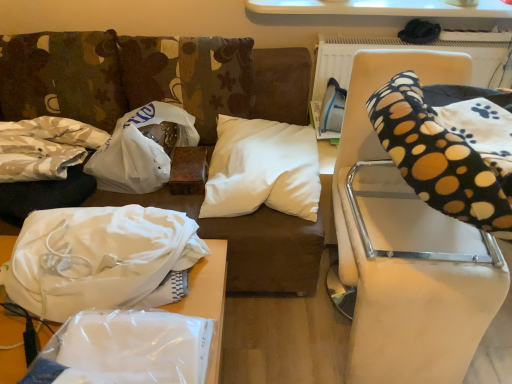
Question: Is white plastic bag at center, the 1th material viewed from the right, closer to camera compared to white fabric at left, the 1th material in the left-to-right sequence?

Choices:
 (A) yes
 (B) no

Answer: (B)

Question: From a real-world perspective, is white plastic bag at center, the 3th material from the left, located higher than white fabric at left, which ranks as the 3th material in right-to-left order?

Choices:
 (A) yes
 (B) no

Answer: (B)

Question: Is white plastic bag at center, the 3th material from the left, touching white fabric at left, the 1th material in the left-to-right sequence?

Choices:
 (A) yes
 (B) no

Answer: (B)

Question: Is white fabric at left, which ranks as the 3th material in right-to-left order, completely or partially inside white plastic bag at center, the 1th material viewed from the right?

Choices:
 (A) yes
 (B) no

Answer: (B)

Question: Does white plastic bag at center, the 1th material viewed from the right, have a smaller size compared to white fabric at left, the 1th material in the left-to-right sequence?

Choices:
 (A) no
 (B) yes

Answer: (B)

Question: From the image's perspective, does white plastic bag at center, the 3th material from the left, appear higher than white fabric at left, which ranks as the 3th material in right-to-left order?

Choices:
 (A) yes
 (B) no

Answer: (A)

Question: Is white fabric at lower left, arranged as the 2th material when viewed from the right, to the left of white fabric at left, which ranks as the 3th material in right-to-left order, from the viewer's perspective?

Choices:
 (A) yes
 (B) no

Answer: (B)

Question: Is white fabric at lower left, arranged as the 2th material when viewed from the right, wider than white fabric at left, the 1th material in the left-to-right sequence?

Choices:
 (A) yes
 (B) no

Answer: (A)

Question: Does white fabric at lower left, arranged as the 2th material when viewed from the right, have a greater height compared to white fabric at left, the 1th material in the left-to-right sequence?

Choices:
 (A) yes
 (B) no

Answer: (A)

Question: Does white fabric at lower left, arranged as the 2th material when viewed from the right, have a lesser height compared to white fabric at left, the 1th material in the left-to-right sequence?

Choices:
 (A) yes
 (B) no

Answer: (B)

Question: Does white fabric at lower left, which appears as the 2th material when viewed from the left, come behind white fabric at left, which ranks as the 3th material in right-to-left order?

Choices:
 (A) no
 (B) yes

Answer: (A)

Question: Could you tell me if white fabric at lower left, arranged as the 2th material when viewed from the right, is facing white fabric at left, the 1th material in the left-to-right sequence?

Choices:
 (A) yes
 (B) no

Answer: (B)

Question: Can you see transparent plastic bag at lower left, acting as the second furniture starting from the right, touching white fabric at left, the 1th material in the left-to-right sequence?

Choices:
 (A) no
 (B) yes

Answer: (A)